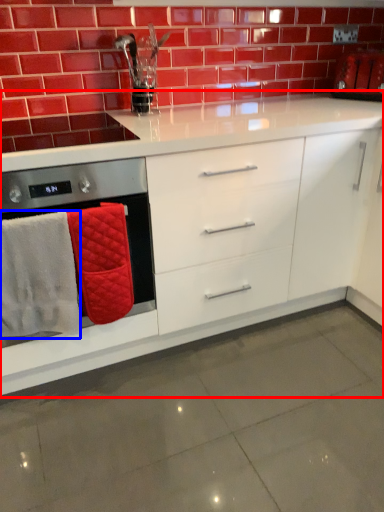
Question: Which object is further to the camera taking this photo, cabinetry (highlighted by a red box) or bath towel (highlighted by a blue box)?

Choices:
 (A) cabinetry
 (B) bath towel

Answer: (B)